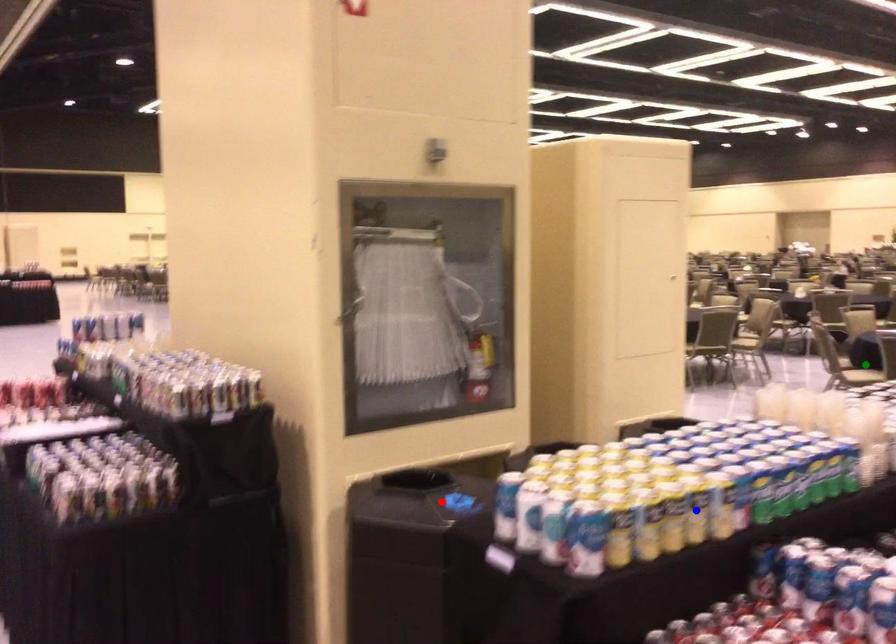
Order these from nearest to farthest:
1. green point
2. blue point
3. red point

blue point < red point < green point